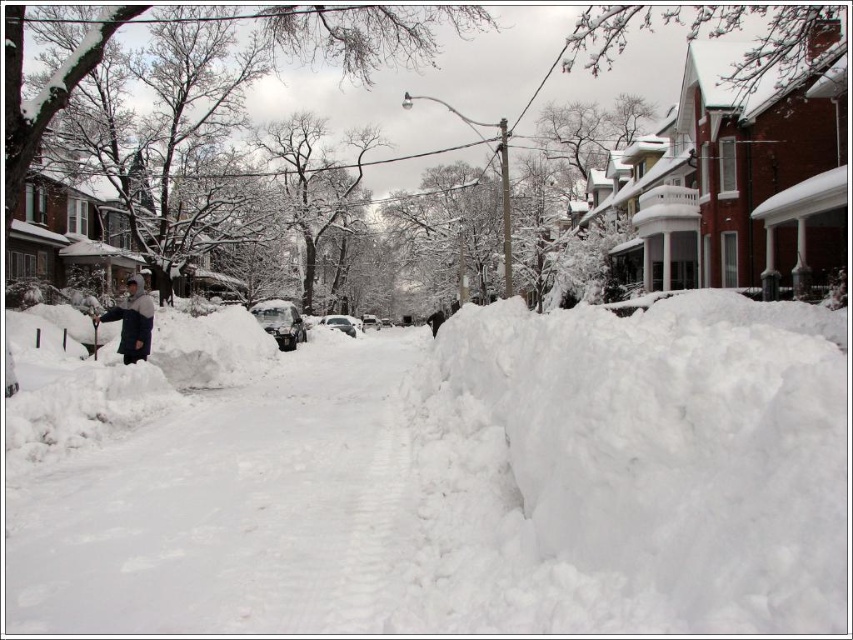
Question: Which object is farther from the camera taking this photo?

Choices:
 (A) white fluffy snow at lower right
 (B) white snow pavement at center
 (C) snow-covered sedan at center

Answer: (C)

Question: Does white fluffy snow at lower right appear on the left side of white snow pavement at center?

Choices:
 (A) no
 (B) yes

Answer: (A)

Question: Which point is farther to the camera?

Choices:
 (A) (334, 317)
 (B) (235, 524)
 (C) (270, 300)

Answer: (A)

Question: Can you confirm if white fluffy snow at lower right is thinner than white snow pavement at center?

Choices:
 (A) no
 (B) yes

Answer: (A)

Question: Is white snow pavement at center wider than snow-covered sedan at center?

Choices:
 (A) no
 (B) yes

Answer: (B)

Question: Which point is farther from the camera taking this photo?

Choices:
 (A) (103, 602)
 (B) (503, 380)

Answer: (B)